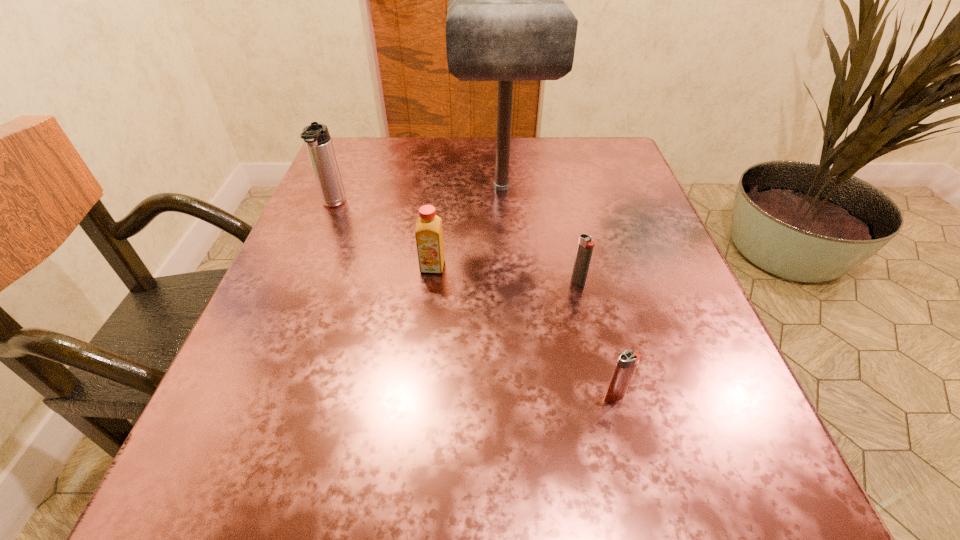
Image resolution: width=960 pixels, height=540 pixels. I want to click on free space between the nearest object and the leftmost object, so click(x=474, y=300).

Locate an element on the screen. vacant point located between the thermos bottle and the second nearest object is located at coordinates (456, 243).

Locate an element on the screen. The height and width of the screenshot is (540, 960). free space between the third object from left to right and the orange juice is located at coordinates (468, 227).

Select which object is the fourth closest to the third nearest object. Please provide its 2D coordinates. Your answer should be formatted as a tuple, i.e. [(x, y)], where the tuple contains the x and y coordinates of a point satisfying the conditions above.

[(627, 361)]

I want to click on object that is the third closest to the nearest object, so click(x=507, y=20).

This screenshot has width=960, height=540. Find the location of `vacant position in the image that satisfies the following two spatial constraints: 1. on the front side of the tallest object; 2. on the left side of the nearer igniter`. vacant position in the image that satisfies the following two spatial constraints: 1. on the front side of the tallest object; 2. on the left side of the nearer igniter is located at coordinates (516, 395).

At what (x,y) coordinates should I click in order to perform the action: click on free space in the image that satisfies the following two spatial constraints: 1. on the front and back of the third shortest object; 2. on the left side of the nearest object. Please return your answer as a coordinate pair (x, y). The width and height of the screenshot is (960, 540). Looking at the image, I should click on (418, 395).